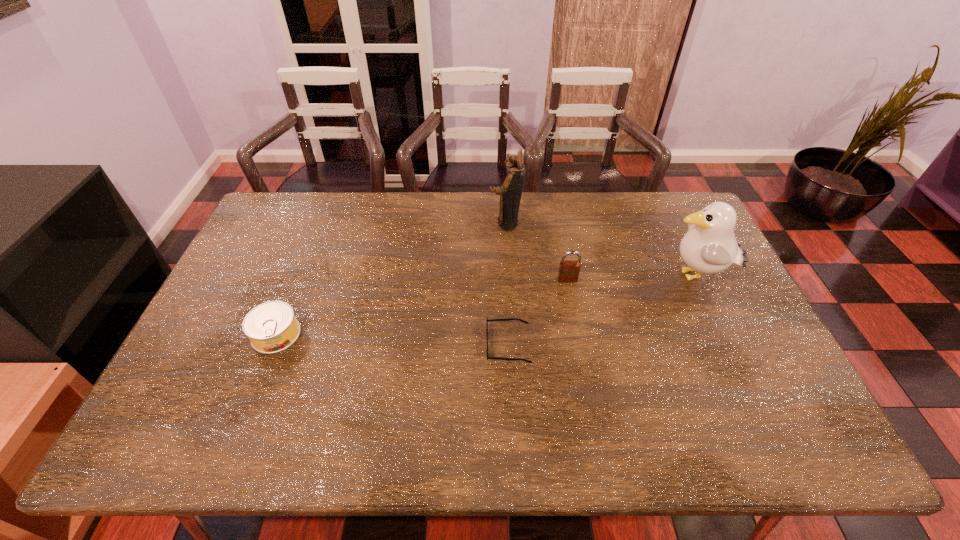
The height and width of the screenshot is (540, 960). I want to click on free space that satisfies the following two spatial constraints: 1. on the beak of the gull; 2. on the front-facing side of the third tallest object, so click(x=696, y=280).